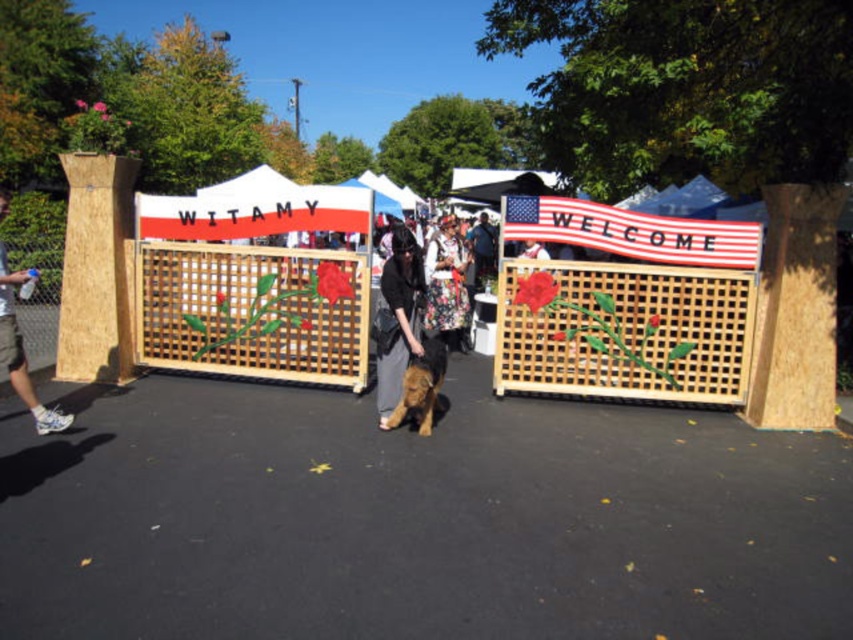
Is american flag at center thinner than matte black jacket at center?

Incorrect, american flag at center's width is not less than matte black jacket at center's.

Is american flag at center bigger than matte black jacket at center?

Indeed, american flag at center has a larger size compared to matte black jacket at center.

Who is more distant from viewer, (682, 220) or (418, 266)?

The point (682, 220) is behind.

Find the location of a particular element. This screenshot has width=853, height=640. american flag at center is located at coordinates (631, 230).

Can you confirm if american flag at center is smaller than floral fabric dress at center?

Incorrect, american flag at center is not smaller in size than floral fabric dress at center.

Between american flag at center and floral fabric dress at center, which one appears on the left side from the viewer's perspective?

Positioned to the left is floral fabric dress at center.

Which is behind, point (505, 228) or point (454, 243)?

Positioned behind is point (454, 243).

Locate an element on the screen. american flag at center is located at coordinates (631, 230).

Between wooden lattice fence at center and white cotton t-shirt at left, which one has more height?

With more height is white cotton t-shirt at left.

Which is above, wooden lattice fence at center or white cotton t-shirt at left?

white cotton t-shirt at left is higher up.

Between point (601, 369) and point (1, 358), which one is positioned in front?

Point (1, 358) is in front.

Locate an element on the screen. wooden lattice fence at center is located at coordinates (627, 332).